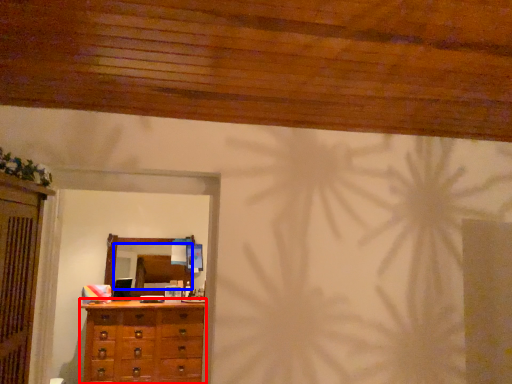
Question: Which of the following is the farthest to the observer, chest of drawers (highlighted by a red box) or mirror (highlighted by a blue box)?

Choices:
 (A) chest of drawers
 (B) mirror

Answer: (B)